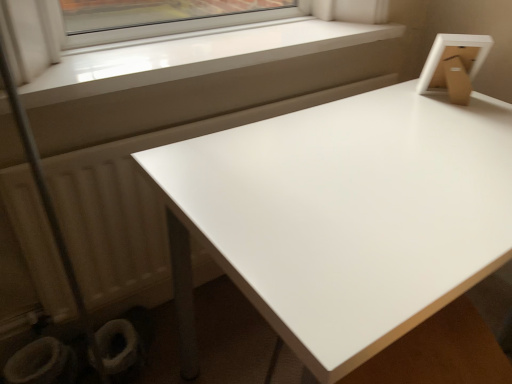
Locate an element on the screen. vacant space situated above white glossy table at upper right (from a real-world perspective) is located at coordinates (378, 171).